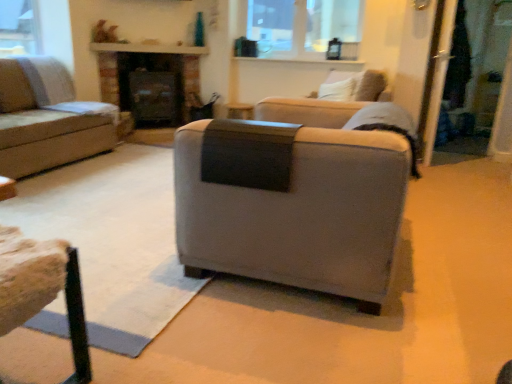
Question: Considering the relative sizes of light gray fabric armchair at upper right and wooden textured stool at lower left in the image provided, is light gray fabric armchair at upper right thinner than wooden textured stool at lower left?

Choices:
 (A) no
 (B) yes

Answer: (A)

Question: Does light gray fabric armchair at upper right lie behind wooden textured stool at lower left?

Choices:
 (A) yes
 (B) no

Answer: (A)

Question: Is wooden textured stool at lower left located within light gray fabric armchair at upper right?

Choices:
 (A) yes
 (B) no

Answer: (B)

Question: Are light gray fabric armchair at upper right and wooden textured stool at lower left beside each other?

Choices:
 (A) yes
 (B) no

Answer: (B)

Question: Does light gray fabric armchair at upper right appear on the right side of wooden textured stool at lower left?

Choices:
 (A) no
 (B) yes

Answer: (B)

Question: Which is correct: matte black fireplace at center is inside light beige fabric couch at left, which is counted as the first studio couch, starting from the left, or outside of it?

Choices:
 (A) outside
 (B) inside

Answer: (A)

Question: Relative to light beige fabric couch at left, the 2th studio couch viewed from the right, is matte black fireplace at center in front or behind?

Choices:
 (A) front
 (B) behind

Answer: (B)

Question: Based on their sizes in the image, would you say matte black fireplace at center is bigger or smaller than light beige fabric couch at left, the 2th studio couch viewed from the right?

Choices:
 (A) small
 (B) big

Answer: (A)

Question: Does point (123, 92) appear closer or farther from the camera than point (2, 148)?

Choices:
 (A) farther
 (B) closer

Answer: (A)

Question: Is matte black fireplace at center in front of or behind suede gray armchair at center, the 2th studio couch in the top-to-bottom sequence, in the image?

Choices:
 (A) front
 (B) behind

Answer: (B)

Question: In terms of size, does matte black fireplace at center appear bigger or smaller than suede gray armchair at center, the 2th studio couch in the top-to-bottom sequence?

Choices:
 (A) big
 (B) small

Answer: (B)

Question: Considering the relative positions of matte black fireplace at center and suede gray armchair at center, arranged as the 1th studio couch when viewed from the right, in the image provided, is matte black fireplace at center to the left or to the right of suede gray armchair at center, arranged as the 1th studio couch when viewed from the right,?

Choices:
 (A) right
 (B) left

Answer: (B)

Question: Does point (175, 86) appear closer or farther from the camera than point (269, 148)?

Choices:
 (A) closer
 (B) farther

Answer: (B)

Question: Would you say clear glass window at upper center is to the left or to the right of suede gray armchair at center, arranged as the 1th studio couch when viewed from the right, in the picture?

Choices:
 (A) left
 (B) right

Answer: (B)

Question: In terms of height, does clear glass window at upper center look taller or shorter compared to suede gray armchair at center, acting as the second studio couch starting from the left?

Choices:
 (A) tall
 (B) short

Answer: (B)